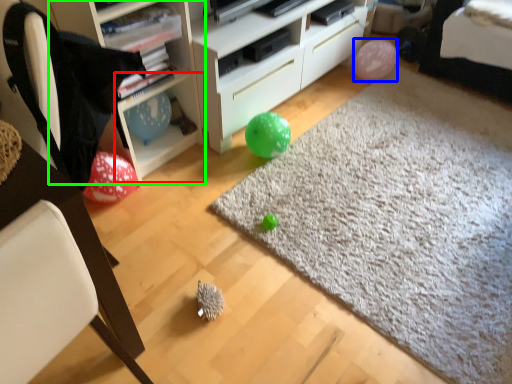
Question: Estimate the real-world distances between objects in this image. Which object is closer to cabinet (highlighted by a red box), balloon (highlighted by a blue box) or shelf (highlighted by a green box)?

Choices:
 (A) balloon
 (B) shelf

Answer: (B)